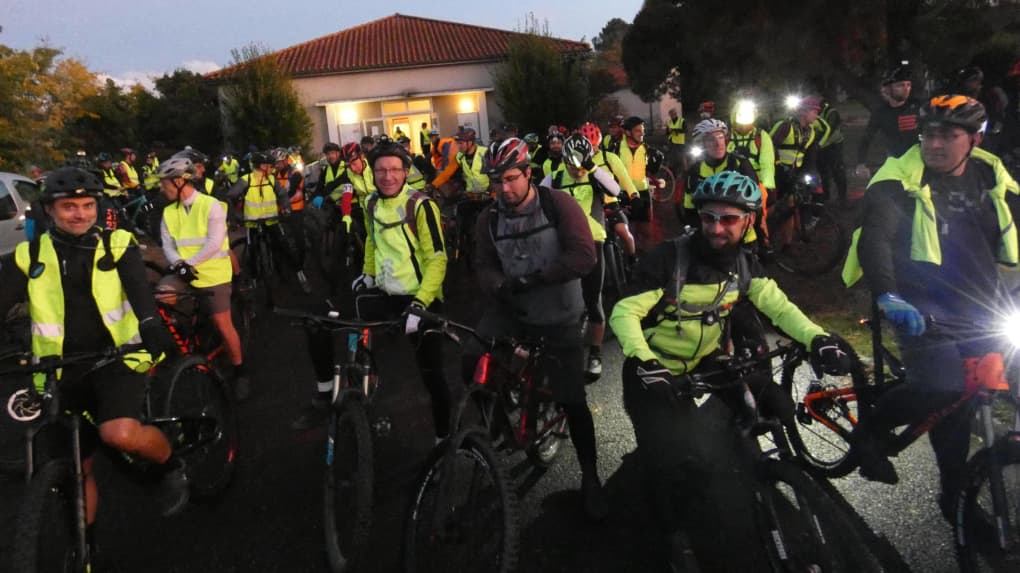
Locate an element on the screen. This screenshot has height=573, width=1020. doors is located at coordinates (389, 120), (423, 115).